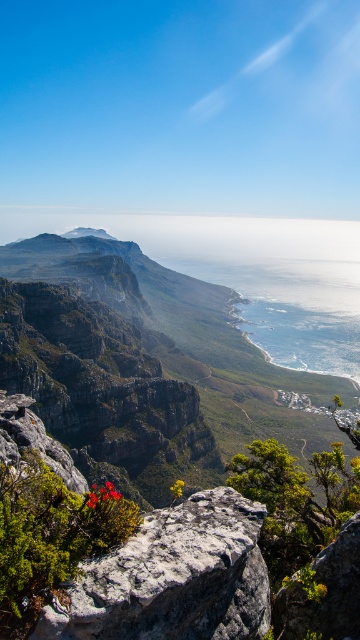
You are a hiker standing at the edge of the rugged coastline and you see the gray rough rock at center and the bright red flower at center. You want to place a 10 meter long rope between them to create a makeshift bridge. Will the rope be long enough?

The gray rough rock at center and bright red flower at center are 8.10 meters apart from each other. The rope is 10 meters long, which is longer than the distance between them, so the rope will be long enough to create the makeshift bridge.

You are a hiker standing at the edge of the rugged coastline and see the gray rough rock at center and the matte gray rock at center. Which rock is taller?

The gray rough rock at center is shorter than the matte gray rock at center, so the matte gray rock at center is taller.